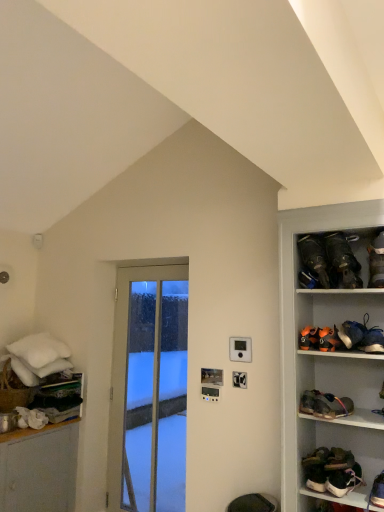
Question: Can you confirm if white leather sneakers at lower right, acting as the tenth footwear starting from the top, is taller than leather brown shoe at right, the 5th footwear from the bottom?

Choices:
 (A) yes
 (B) no

Answer: (A)

Question: Does white leather sneakers at lower right, which is the first footwear from bottom to top, appear on the left side of leather brown shoe at right, placed as the sixth footwear when sorted from top to bottom?

Choices:
 (A) yes
 (B) no

Answer: (B)

Question: Is white leather sneakers at lower right, acting as the tenth footwear starting from the top, bigger than leather brown shoe at right, placed as the sixth footwear when sorted from top to bottom?

Choices:
 (A) no
 (B) yes

Answer: (B)

Question: Does white leather sneakers at lower right, which is the first footwear from bottom to top, have a smaller size compared to leather brown shoe at right, placed as the sixth footwear when sorted from top to bottom?

Choices:
 (A) no
 (B) yes

Answer: (A)

Question: Is white leather sneakers at lower right, which is the first footwear from bottom to top, further to camera compared to leather brown shoe at right, the 5th footwear from the bottom?

Choices:
 (A) no
 (B) yes

Answer: (A)

Question: Is point (322, 345) positioned closer to the camera than point (375, 483)?

Choices:
 (A) farther
 (B) closer

Answer: (A)

Question: From a real-world perspective, relative to matte black shoe at lower right, which appears as the 2th footwear when ordered from the bottom, is orange suede shoe at upper right, which is counted as the fourth footwear, starting from the top, vertically above or below?

Choices:
 (A) below
 (B) above

Answer: (B)

Question: Considering the positions of orange suede shoe at upper right, positioned as the 7th footwear in bottom-to-top order, and matte black shoe at lower right, which appears as the 2th footwear when ordered from the bottom, in the image, is orange suede shoe at upper right, positioned as the 7th footwear in bottom-to-top order, wider or thinner than matte black shoe at lower right, which appears as the 2th footwear when ordered from the bottom,?

Choices:
 (A) thin
 (B) wide

Answer: (A)

Question: Is orange suede shoe at upper right, positioned as the 7th footwear in bottom-to-top order, inside the boundaries of matte black shoe at lower right, which appears as the 2th footwear when ordered from the bottom, or outside?

Choices:
 (A) inside
 (B) outside

Answer: (B)

Question: Based on their sizes in the image, would you say black leather shoes at upper right, arranged as the first footwear when viewed from the top, is bigger or smaller than leather brown shoe at right, placed as the sixth footwear when sorted from top to bottom?

Choices:
 (A) small
 (B) big

Answer: (B)

Question: From a real-world perspective, is black leather shoes at upper right, placed as the 10th footwear when sorted from bottom to top, positioned above or below leather brown shoe at right, placed as the sixth footwear when sorted from top to bottom?

Choices:
 (A) above
 (B) below

Answer: (A)

Question: Is black leather shoes at upper right, arranged as the first footwear when viewed from the top, spatially inside leather brown shoe at right, the 5th footwear from the bottom, or outside of it?

Choices:
 (A) inside
 (B) outside

Answer: (B)

Question: Considering the positions of black leather shoes at upper right, arranged as the first footwear when viewed from the top, and leather brown shoe at right, placed as the sixth footwear when sorted from top to bottom, in the image, is black leather shoes at upper right, arranged as the first footwear when viewed from the top, wider or thinner than leather brown shoe at right, placed as the sixth footwear when sorted from top to bottom,?

Choices:
 (A) wide
 (B) thin

Answer: (A)

Question: In the image, is brown suede boot at right, the second footwear positioned from the top, positioned in front of or behind green suede shoes at lower right, acting as the 3th footwear starting from the bottom?

Choices:
 (A) behind
 (B) front

Answer: (B)

Question: From their relative heights in the image, would you say brown suede boot at right, the second footwear positioned from the top, is taller or shorter than green suede shoes at lower right, acting as the 3th footwear starting from the bottom?

Choices:
 (A) short
 (B) tall

Answer: (B)